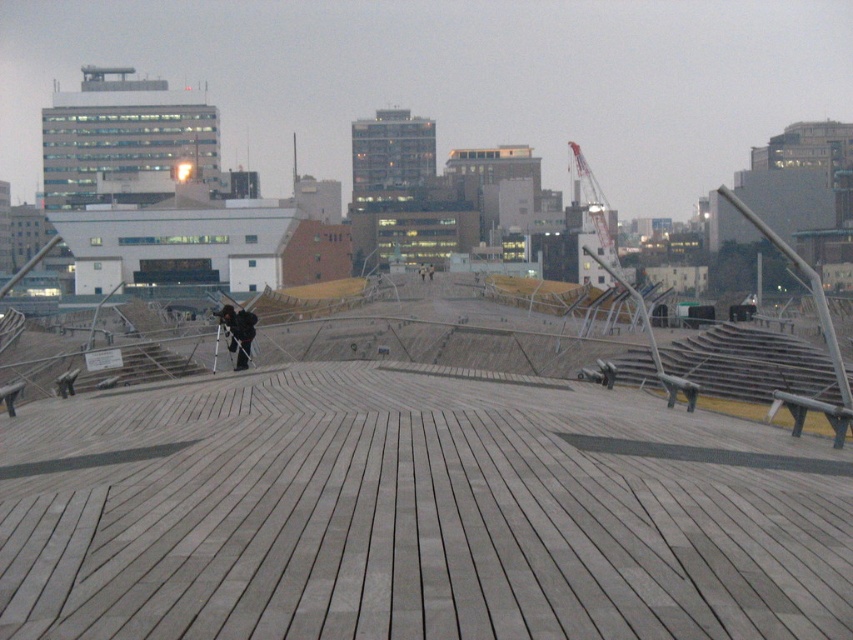
How much distance is there between black matte jacket at center and dark gray fabric jacket at center?

A distance of 209.86 feet exists between black matte jacket at center and dark gray fabric jacket at center.

Between point (238, 365) and point (427, 268), which one is positioned behind?

The point (427, 268) is more distant.

Does point (228, 305) come in front of point (430, 273)?

Yes, point (228, 305) is in front of point (430, 273).

Where is `black matte jacket at center`? The image size is (853, 640). black matte jacket at center is located at coordinates pyautogui.click(x=238, y=332).